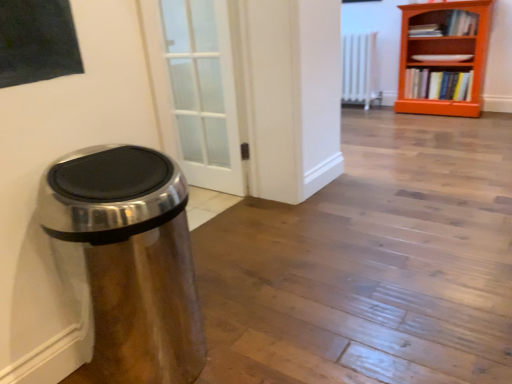
Image resolution: width=512 pixels, height=384 pixels. What are the coordinates of `blank area beneath satin metallic trash can at left (from a real-world perspective)` in the screenshot? It's located at (156, 361).